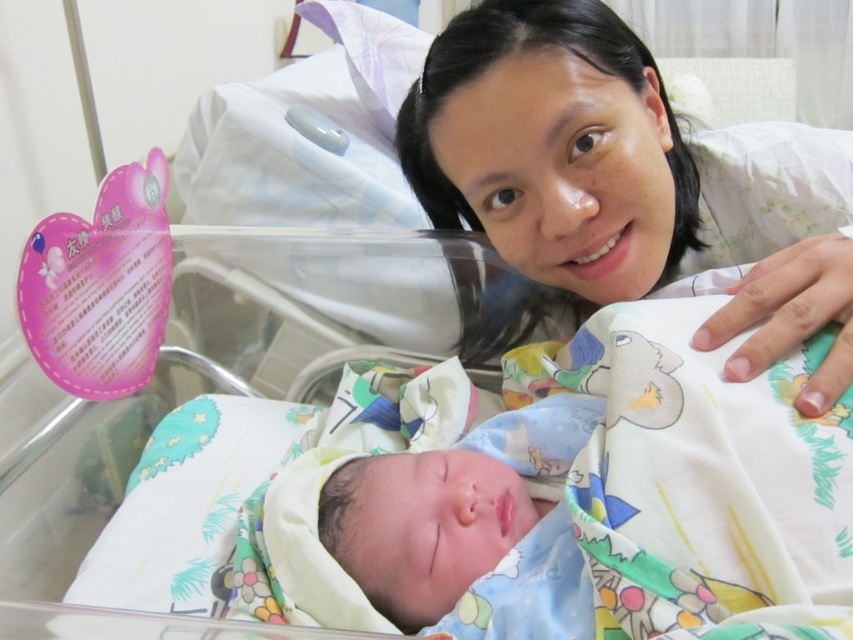
You are a nurse in a hospital room. You need to retrieve the white fabric at upper center for a medical procedure. The procedure requires that the fabric be within 20 inches of you to use effectively. Are you able to reach it without moving your position?

The white fabric at upper center is 20.56 inches from the camera, which is slightly beyond the 20 inches required for effective use. Therefore, you may need to adjust your position to bring it within reach.

You are a nurse in the hospital room. You need to retrieve the white fabric at upper center and the soft blue fabric at center. Which fabric should you reach for first if you want to grab the one closer to your right side?

The white fabric at upper center is to the right of the soft blue fabric at center, so you should reach for the white fabric at upper center first since it is already positioned to your right side.